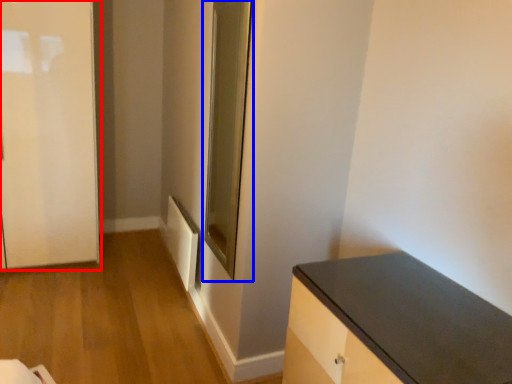
Question: Among these objects, which one is nearest to the camera, door (highlighted by a red box) or glass door (highlighted by a blue box)?

Choices:
 (A) door
 (B) glass door

Answer: (B)